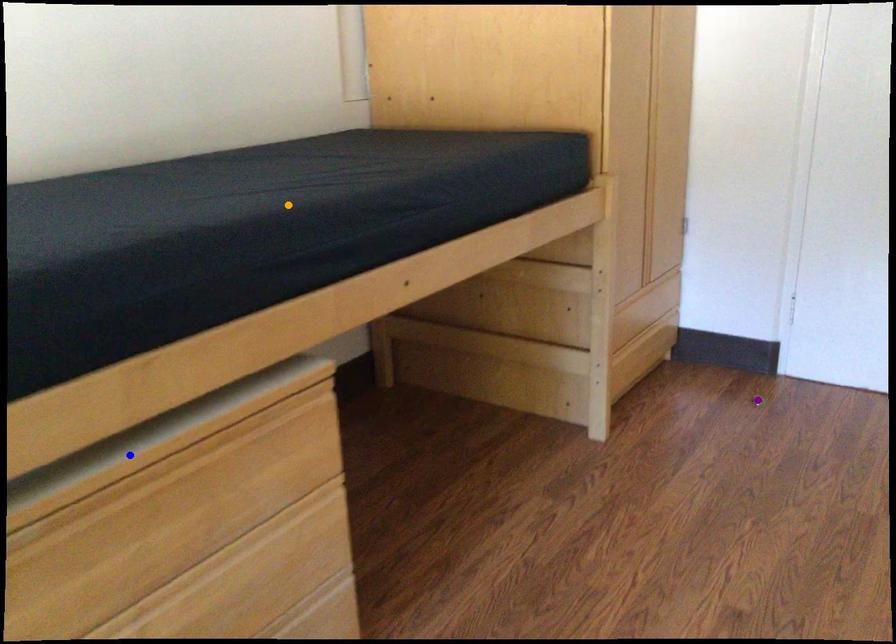
Order these from farthest to nearest:
A) orange point
B) purple point
C) blue point

purple point
orange point
blue point